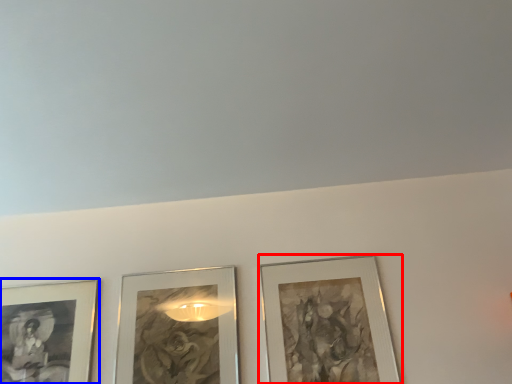
Question: Which of the following is the farthest to the observer, picture frame (highlighted by a red box) or picture frame (highlighted by a blue box)?

Choices:
 (A) picture frame
 (B) picture frame

Answer: (B)